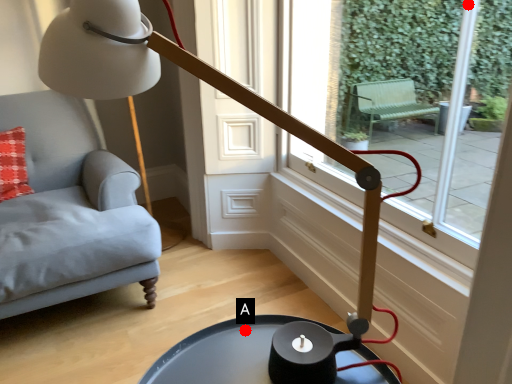
Question: Two points are circled on the image, labeled by A and B beside each circle. Among these points, which one is farthest from the camera?

Choices:
 (A) A is further
 (B) B is further

Answer: (B)